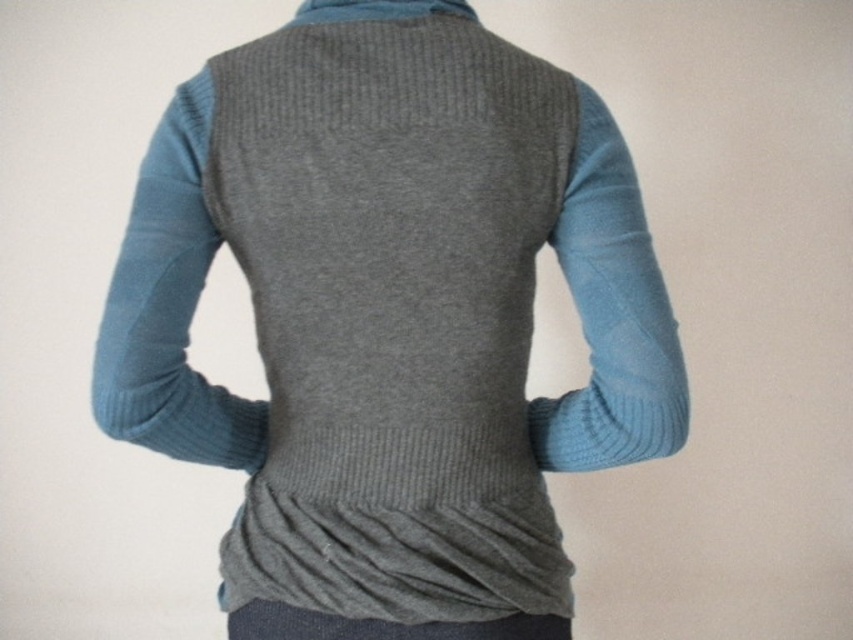
Between knitted gray cardigan at center and light blue ribbed sweater sleeve at right, which one is positioned lower?

knitted gray cardigan at center is lower down.

Which is more to the left, knitted gray cardigan at center or light blue ribbed sweater sleeve at right?

knitted gray cardigan at center is more to the left.

This screenshot has width=853, height=640. I want to click on knitted gray cardigan at center, so click(390, 320).

Consider the image. Between matte gray pocket at lower center and teal ribbed sweater sleeve at left, which one has more height?

Standing taller between the two is teal ribbed sweater sleeve at left.

Is matte gray pocket at lower center smaller than teal ribbed sweater sleeve at left?

Yes.

Is point (511, 524) closer to camera compared to point (186, 406)?

Yes, point (511, 524) is closer to viewer.

Where is `matte gray pocket at lower center`? This screenshot has height=640, width=853. matte gray pocket at lower center is located at coordinates (397, 557).

Does teal ribbed sweater sleeve at left have a greater width compared to light blue ribbed sweater sleeve at right?

Yes.

Who is positioned more to the left, teal ribbed sweater sleeve at left or light blue ribbed sweater sleeve at right?

Positioned to the left is teal ribbed sweater sleeve at left.

Does point (161, 417) come closer to viewer compared to point (613, 449)?

Yes.

Locate an element on the screen. teal ribbed sweater sleeve at left is located at coordinates (169, 308).